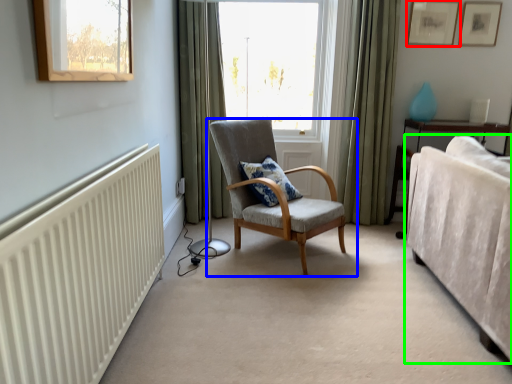
Question: Which is farther away from picture frame (highlighted by a red box)? chair (highlighted by a blue box) or studio couch (highlighted by a green box)?

Choices:
 (A) chair
 (B) studio couch

Answer: (A)